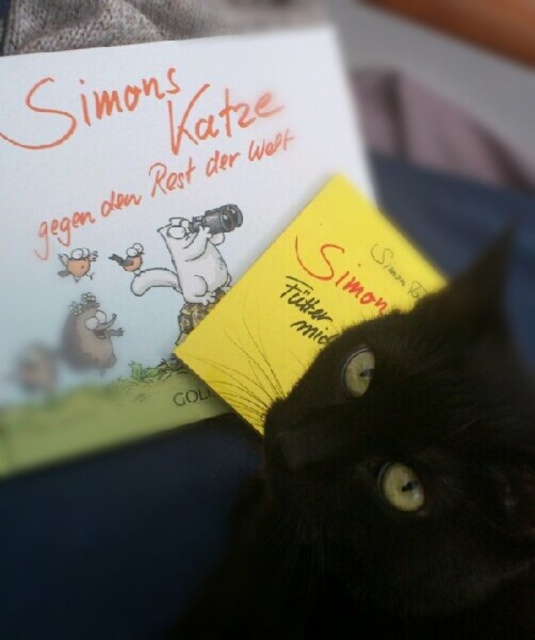
Can you confirm if orange handwritten text at upper left is positioned below yellow paper at center?

No, orange handwritten text at upper left is not below yellow paper at center.

Is orange handwritten text at upper left thinner than yellow paper at center?

No.

Is point (133, 172) positioned behind point (293, 310)?

No, it is not.

Where is `orange handwritten text at upper left`? The height and width of the screenshot is (640, 535). orange handwritten text at upper left is located at coordinates (132, 154).

Can you confirm if black fur cat at center is wider than yellow paper at center?

Incorrect, black fur cat at center's width does not surpass yellow paper at center's.

Does point (292, 637) come behind point (339, 314)?

No, it is not.

Who is more forward, (341, 609) or (307, 214)?

Point (341, 609) is more forward.

Identify the location of black fur cat at center. This screenshot has height=640, width=535. (393, 484).

Between black fur cat at center and orange handwritten text at upper left, which one appears on the left side from the viewer's perspective?

orange handwritten text at upper left is more to the left.

Between black fur cat at center and orange handwritten text at upper left, which one is positioned lower?

black fur cat at center is below.

Which is behind, point (269, 624) or point (19, 172)?

The point (19, 172) is more distant.

Identify the location of black fur cat at center. (393, 484).